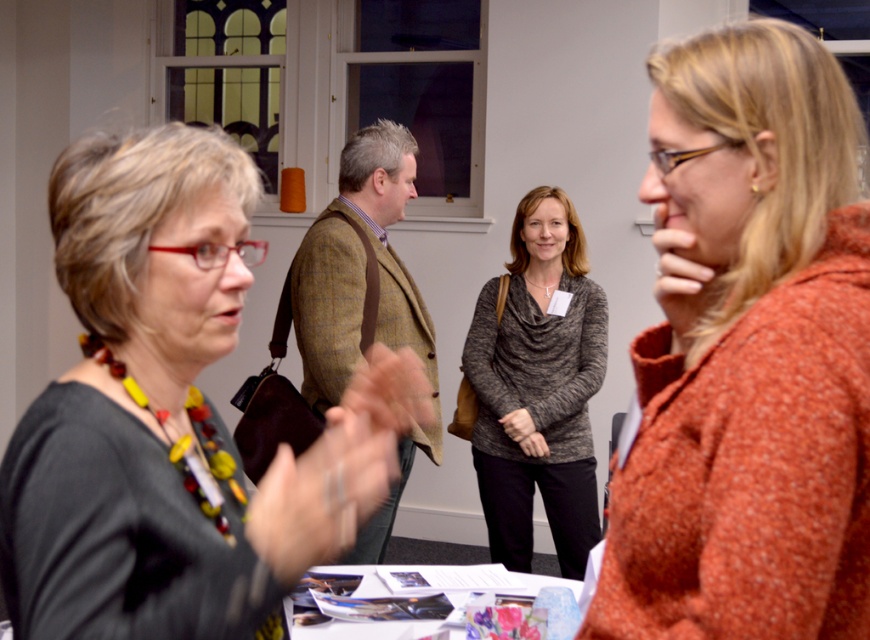
Does orange speckled sweater at right have a larger size compared to white paper at center?

Indeed, orange speckled sweater at right has a larger size compared to white paper at center.

Can you confirm if orange speckled sweater at right is wider than white paper at center?

In fact, orange speckled sweater at right might be narrower than white paper at center.

Find the location of a particular element. The image size is (870, 640). orange speckled sweater at right is located at coordinates click(x=748, y=355).

Does matte black sweater at center lie behind knit sweater at center?

No, matte black sweater at center is closer to the viewer.

Who is more distant from viewer, [264,497] or [554,349]?

Point [554,349]

Image resolution: width=870 pixels, height=640 pixels. Identify the location of matte black sweater at center. (172, 416).

In the scene shown: Between orange speckled sweater at right and knit sweater at center, which one is positioned higher?

Positioned higher is orange speckled sweater at right.

Can you confirm if orange speckled sweater at right is bigger than knit sweater at center?

No, orange speckled sweater at right is not bigger than knit sweater at center.

Does point (660, 484) lie behind point (540, 483)?

No, it is in front of (540, 483).

You are a GUI agent. You are given a task and a screenshot of the screen. Output one action in this format:
    pyautogui.click(x=<x>, y=<y>)
    Task: Click on the orange speckled sweater at right
    The image size is (870, 640).
    Given the screenshot: What is the action you would take?
    pyautogui.click(x=748, y=355)